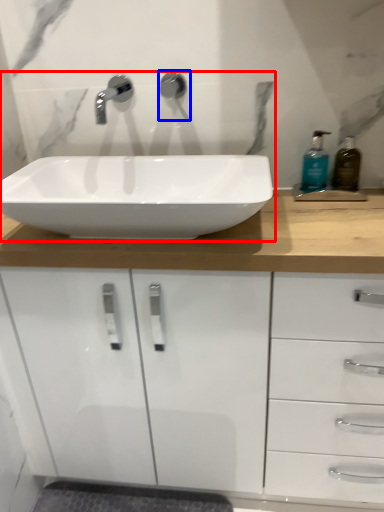
Question: Which object is closer to the camera taking this photo, sink (highlighted by a red box) or plumbing fixture (highlighted by a blue box)?

Choices:
 (A) sink
 (B) plumbing fixture

Answer: (A)